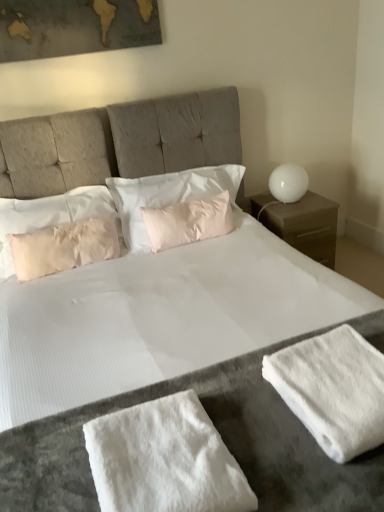
The height and width of the screenshot is (512, 384). Identify the location of vacant space to the right of white fluffy towel at lower center. (277, 450).